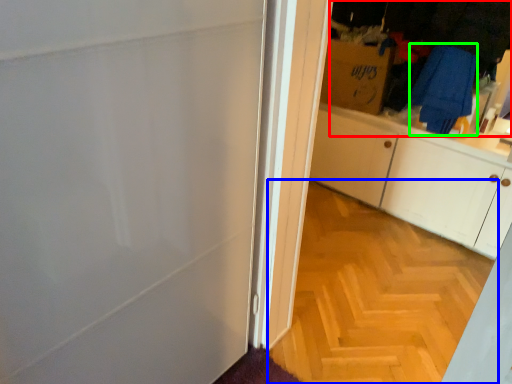
Question: Based on their relative distances, which object is nearer to laundry (highlighted by a red box)? Choose from plain (highlighted by a blue box) and laundry (highlighted by a green box).

Choices:
 (A) plain
 (B) laundry

Answer: (B)